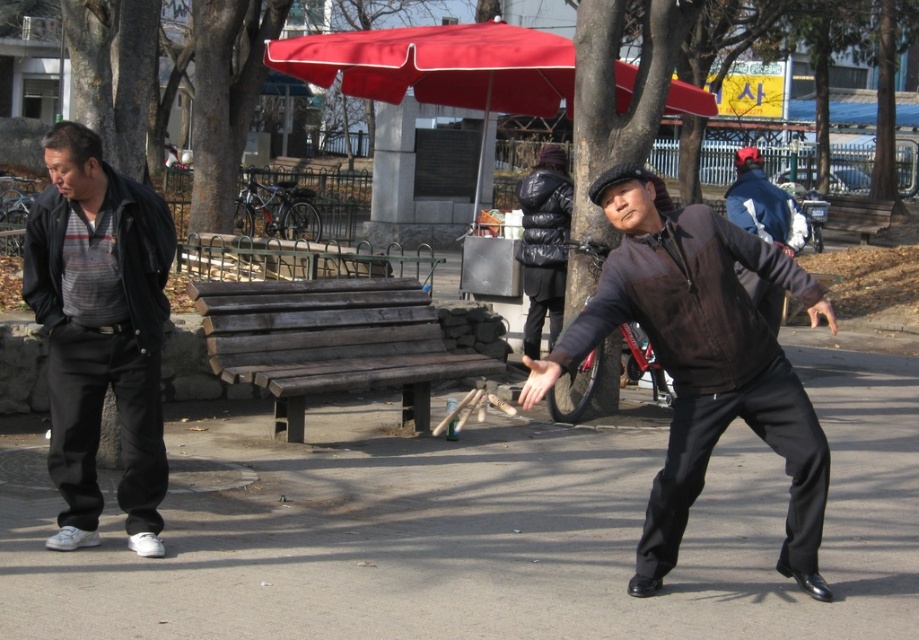
Question: Estimate the real-world distances between objects in this image. Which object is farther from the red fabric umbrella at upper center?

Choices:
 (A) brown suede jacket at center
 (B) dark brown wood bench at center

Answer: (A)

Question: In this image, where is dark brown wood bench at center located relative to dark brown leather jacket at center?

Choices:
 (A) above
 (B) below

Answer: (B)

Question: Which of the following is the closest to the observer?

Choices:
 (A) brown suede jacket at center
 (B) dark brown wood bench at center
 (C) red fabric umbrella at upper center
 (D) matte black jacket at left

Answer: (A)

Question: Can you confirm if dark brown wood bench at center is bigger than red fabric umbrella at upper center?

Choices:
 (A) yes
 (B) no

Answer: (B)

Question: Where is matte black jacket at left located in relation to dark brown wood bench at center in the image?

Choices:
 (A) right
 (B) left

Answer: (B)

Question: Which point is farther from the camera taking this photo?

Choices:
 (A) (777, 394)
 (B) (753, 195)

Answer: (B)